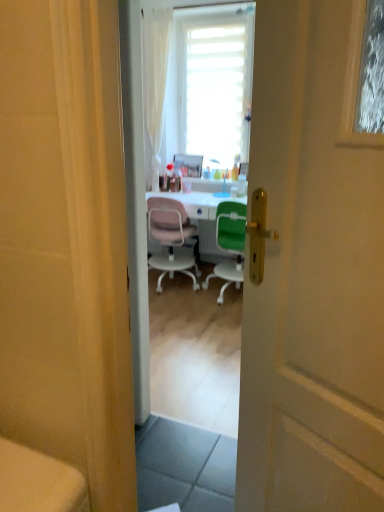
Question: From a real-world perspective, is white glossy desk at center beneath white matte door at center?

Choices:
 (A) yes
 (B) no

Answer: (A)

Question: Can you confirm if white glossy desk at center is smaller than white matte door at center?

Choices:
 (A) no
 (B) yes

Answer: (A)

Question: Is white glossy desk at center in front of white matte door at center?

Choices:
 (A) no
 (B) yes

Answer: (A)

Question: Is white glossy desk at center beside white matte door at center?

Choices:
 (A) no
 (B) yes

Answer: (A)

Question: Does white glossy desk at center have a lesser width compared to white matte door at center?

Choices:
 (A) yes
 (B) no

Answer: (B)

Question: Considering the relative sizes of white glossy desk at center and white matte door at center in the image provided, is white glossy desk at center taller than white matte door at center?

Choices:
 (A) no
 (B) yes

Answer: (A)

Question: Is white matte door at center located within green plastic chair at center, the first chair positioned from the right?

Choices:
 (A) no
 (B) yes

Answer: (A)

Question: From a real-world perspective, does green plastic chair at center, the 2th chair positioned from the left, stand above white matte door at center?

Choices:
 (A) no
 (B) yes

Answer: (A)

Question: From a real-world perspective, does green plastic chair at center, the first chair positioned from the right, sit lower than white matte door at center?

Choices:
 (A) no
 (B) yes

Answer: (B)

Question: From the image's perspective, is green plastic chair at center, the 2th chair positioned from the left, over white matte door at center?

Choices:
 (A) yes
 (B) no

Answer: (A)

Question: Considering the relative sizes of green plastic chair at center, the 2th chair positioned from the left, and white matte door at center in the image provided, is green plastic chair at center, the 2th chair positioned from the left, smaller than white matte door at center?

Choices:
 (A) no
 (B) yes

Answer: (A)

Question: Does green plastic chair at center, the 2th chair positioned from the left, have a greater height compared to white matte door at center?

Choices:
 (A) yes
 (B) no

Answer: (B)

Question: From a real-world perspective, does pink plastic chair at center, positioned as the first chair in left-to-right order, stand above wooden picture frame at center?

Choices:
 (A) no
 (B) yes

Answer: (A)